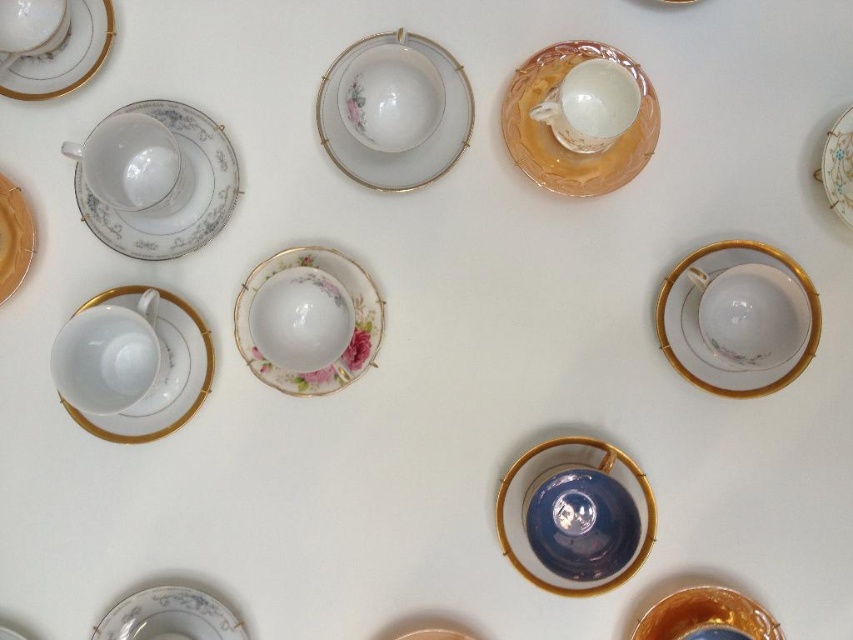
Question: Can you confirm if porcelain floral saucer at center is positioned below porcelain floral saucer at left?

Choices:
 (A) yes
 (B) no

Answer: (B)

Question: Which of the following is the closest to the observer?

Choices:
 (A) porcelain plate at bottom left
 (B) matte gold plate at left

Answer: (A)

Question: Which point appears farthest from the camera in this image?

Choices:
 (A) (10, 180)
 (B) (434, 118)
 (C) (349, 172)
 (D) (157, 225)

Answer: (C)

Question: Which object is the closest to the white porcelain saucer at lower left?

Choices:
 (A) porcelain plate at upper right
 (B) porcelain cup at upper right
 (C) glossy porcelain teacup at center

Answer: (C)

Question: Is glossy porcelain teacup at center to the right of matte porcelain teacup at upper left from the viewer's perspective?

Choices:
 (A) yes
 (B) no

Answer: (A)

Question: Is translucent amber platter at upper right positioned at the back of gold metallic platter at bottom right?

Choices:
 (A) no
 (B) yes

Answer: (B)